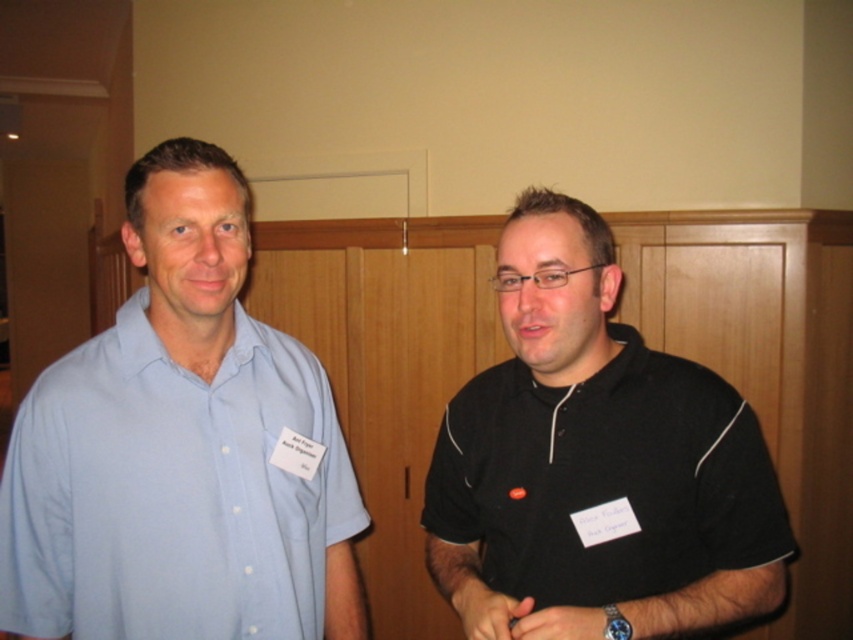
You are standing in a room where two people are present. You notice a point marked at coordinates [647,548]. Can you determine if this point is closer to the camera than the person on the left or the person on the right?

The point at [647,548] is 1.06 meters from the camera. Since the distance of the people from the camera isn not provided, it is impossible to determine which person is closer to the camera compared to the point.

You are organizing a photo shoot and need to ensure that the black matte shirt at right and the light blue cotton shirt at left are framed appropriately. Based on their widths, which shirt should you focus on to avoid cropping issues?

The black matte shirt at right might be wider than the light blue cotton shirt at left, so you should focus on framing the black matte shirt at right to avoid cropping issues due to its potential wider width.